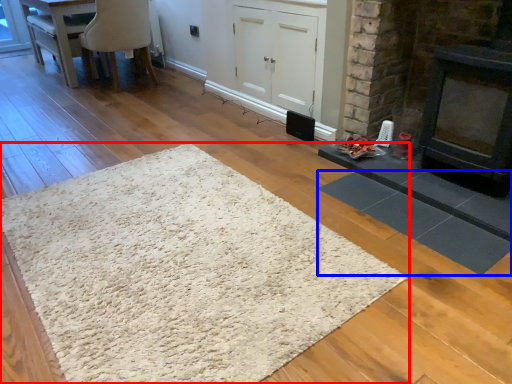
Question: Which of the following is the closest to the observer, mat (highlighted by a red box) or mat (highlighted by a blue box)?

Choices:
 (A) mat
 (B) mat

Answer: (A)